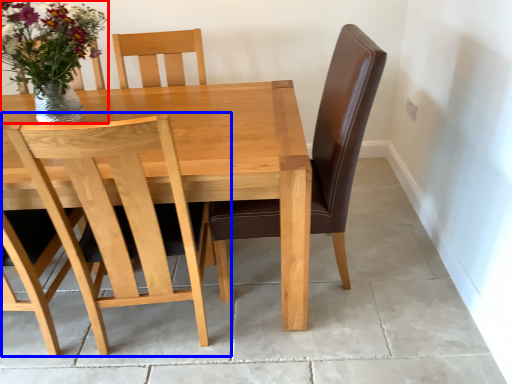
Question: Which object is closer to the camera taking this photo, floral arrangement (highlighted by a red box) or chair (highlighted by a blue box)?

Choices:
 (A) floral arrangement
 (B) chair

Answer: (B)